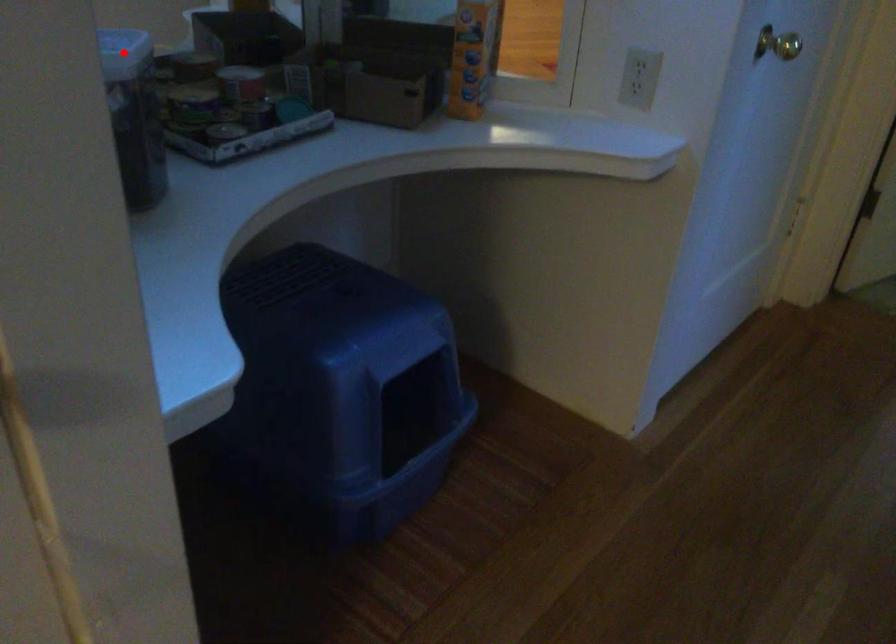
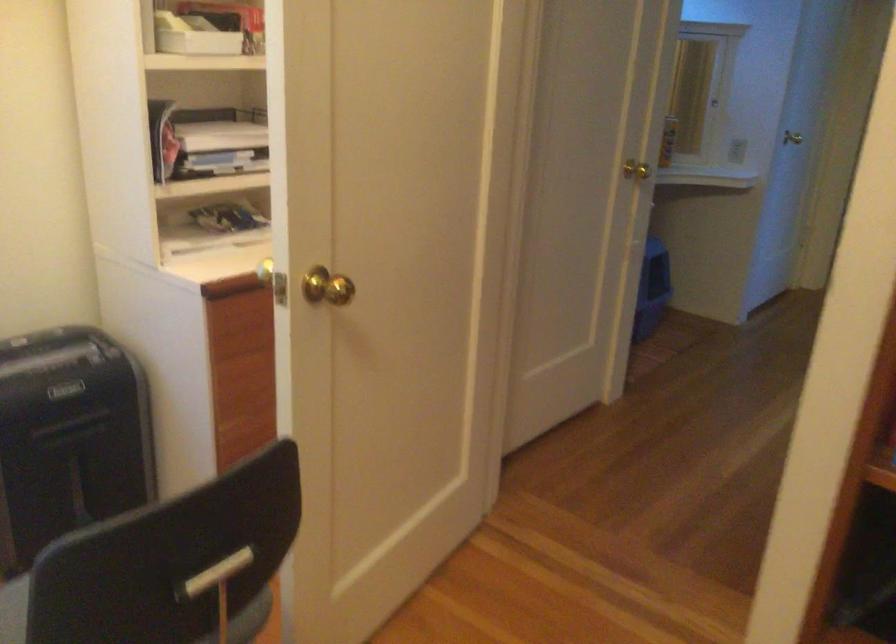
Question: I am providing you with two images of the same scene from different viewpoints. A red point is marked on the first image. At the location where the point appears in image 1, is it still visible in image 2?

Choices:
 (A) Yes
 (B) No

Answer: (B)